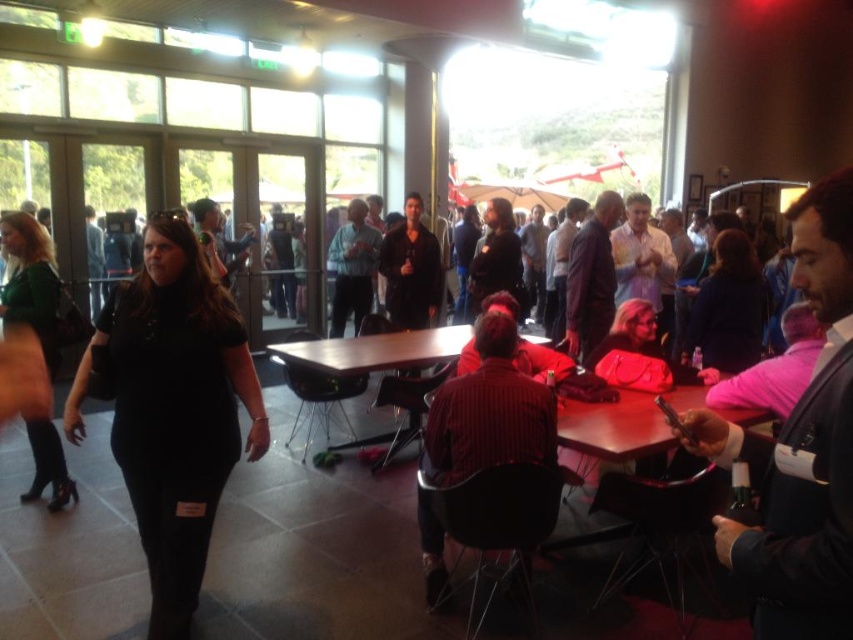
You are organizing a photo shoot and need to position a model wearing the green fabric dress at left next to the wooden table at center. Given their sizes, will the dress fit comfortably next to the table without overcrowding the space?

The green fabric dress at left is narrower than the wooden table at center, so placing the model wearing it next to the table should be possible without overcrowding the space.

You are organizing a photo shoot and need to know which attendee has a wider torso based on their clothing. Which of the two, the black matte shirt at center or the green fabric dress at left, has a wider torso?

The black matte shirt at center has a larger width than the green fabric dress at left, so the attendee wearing the black matte shirt at center has a wider torso.

You are standing at the entrance of the room and see the point marked at coordinates (489, 410). What is the object located at that point?

The point at coordinates (489, 410) corresponds to the striped shirt at center.